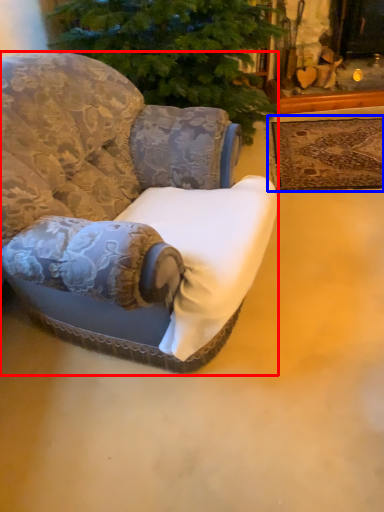
Question: Which point is further to the camera, chair (highlighted by a red box) or mat (highlighted by a blue box)?

Choices:
 (A) chair
 (B) mat

Answer: (B)